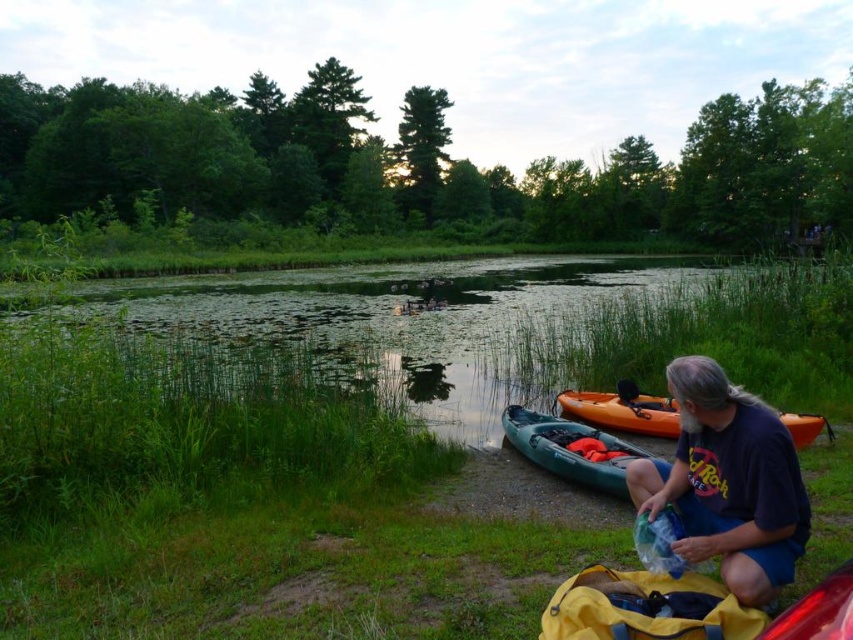
You are standing at the lakeside and want to reach a specific point marked at coordinates point [688,426]. If your maximum comfortable walking distance is 10 feet, can you comfortably walk to that point without needing assistance?

The distance of point [688,426] from viewer is 11.04 feet, which exceeds your maximum comfortable walking distance of 10 feet. Therefore, you may need assistance to reach that point comfortably.

You are standing at the edge of the lake and want to reach a specific point in the water. The first point you need to reach is at coordinate point (762, 458), and the second point is at coordinate point (570, 436). Which point should you reach first if you want to move from the shore towards the center of the lake?

You should reach point (762, 458) first because it is closer to the camera, meaning it is nearer to the shore where you are standing. The second point (570, 436) is further away from the shore and requires moving deeper into the lake.

You are a hiker who just arrived at the lakeside and want to rent a canoe to explore the lake. The rental shop requires that canoes must be at least 2 meters apart for safety. Based on the scene, can you safely rent both the teal plastic canoe at lower center and the orange plastic canoe at lower right?

The teal plastic canoe at lower center is only 1.39 meters away from the orange plastic canoe at lower right, which is less than the required 2 meters for safety. Therefore, you cannot safely rent both canoes as they are too close together.